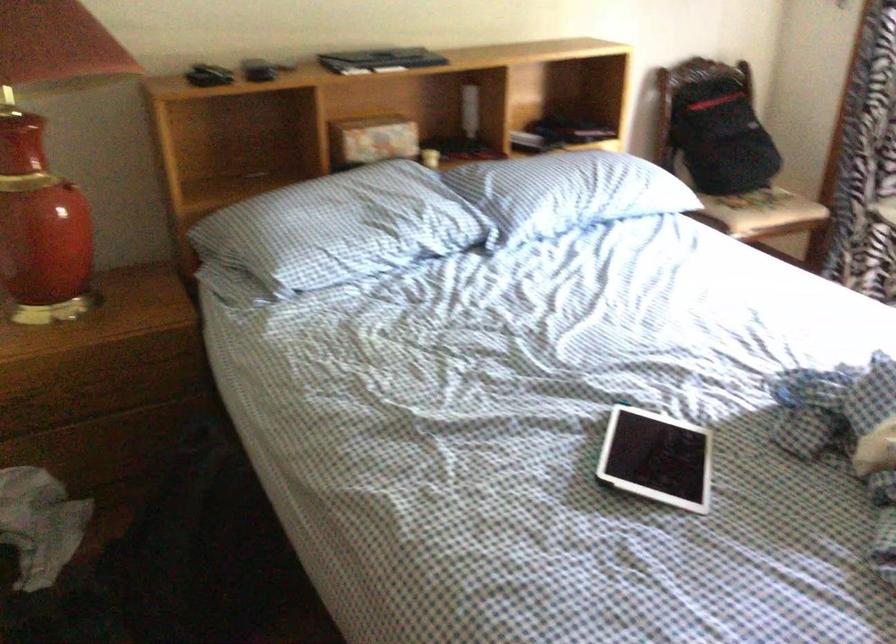
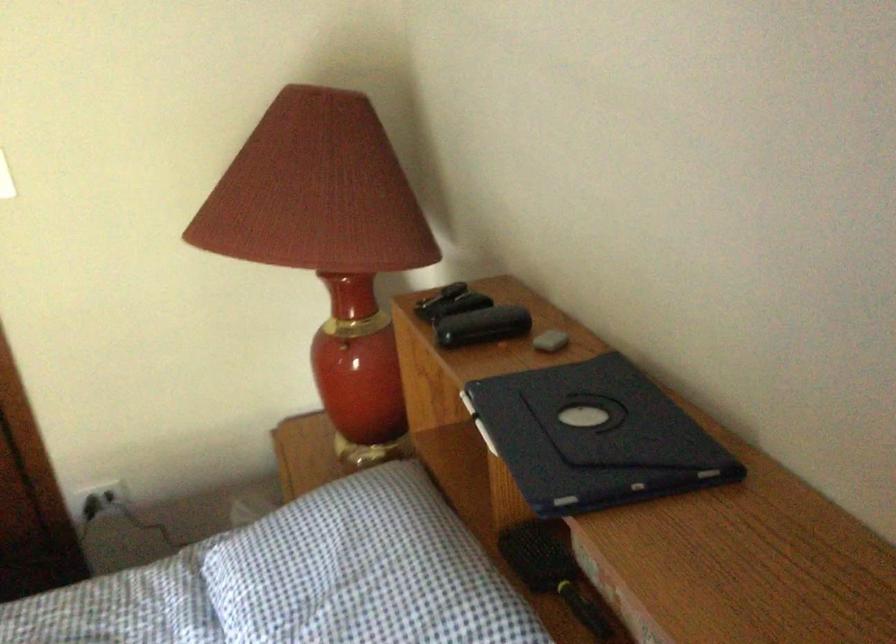
The point at [368,167] is marked in the first image. Where is the corresponding point in the second image?

(552, 571)